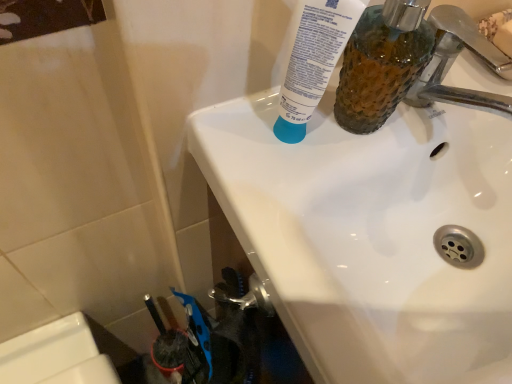
Question: Does translucent textured mouthwash at upper right come behind white glossy sink at upper center?

Choices:
 (A) no
 (B) yes

Answer: (B)

Question: Would you say translucent textured mouthwash at upper right is outside white glossy sink at upper center?

Choices:
 (A) yes
 (B) no

Answer: (A)

Question: Considering the relative sizes of translucent textured mouthwash at upper right and white glossy sink at upper center in the image provided, is translucent textured mouthwash at upper right shorter than white glossy sink at upper center?

Choices:
 (A) no
 (B) yes

Answer: (A)

Question: Is the position of translucent textured mouthwash at upper right less distant than that of white glossy sink at upper center?

Choices:
 (A) no
 (B) yes

Answer: (A)

Question: Can you confirm if translucent textured mouthwash at upper right is taller than white glossy sink at upper center?

Choices:
 (A) yes
 (B) no

Answer: (A)

Question: Is chrome metallic faucet at upper right taller or shorter than translucent textured mouthwash at upper right?

Choices:
 (A) tall
 (B) short

Answer: (B)

Question: Choose the correct answer: Is chrome metallic faucet at upper right inside translucent textured mouthwash at upper right or outside it?

Choices:
 (A) inside
 (B) outside

Answer: (B)

Question: Is chrome metallic faucet at upper right wider or thinner than translucent textured mouthwash at upper right?

Choices:
 (A) wide
 (B) thin

Answer: (A)

Question: In terms of size, does chrome metallic faucet at upper right appear bigger or smaller than translucent textured mouthwash at upper right?

Choices:
 (A) small
 (B) big

Answer: (A)

Question: Is white glossy sink at upper center wider or thinner than chrome metallic faucet at upper right?

Choices:
 (A) thin
 (B) wide

Answer: (B)

Question: Looking at the image, does white glossy sink at upper center seem bigger or smaller compared to chrome metallic faucet at upper right?

Choices:
 (A) big
 (B) small

Answer: (A)

Question: In the image, is white glossy sink at upper center positioned in front of or behind chrome metallic faucet at upper right?

Choices:
 (A) front
 (B) behind

Answer: (A)

Question: Considering the relative positions of white glossy sink at upper center and chrome metallic faucet at upper right in the image provided, is white glossy sink at upper center to the left or to the right of chrome metallic faucet at upper right?

Choices:
 (A) left
 (B) right

Answer: (A)

Question: From the image's perspective, is chrome metallic faucet at upper right located above or below white glossy sink at upper center?

Choices:
 (A) above
 (B) below

Answer: (A)

Question: Considering the positions of chrome metallic faucet at upper right and white glossy sink at upper center in the image, is chrome metallic faucet at upper right taller or shorter than white glossy sink at upper center?

Choices:
 (A) short
 (B) tall

Answer: (A)